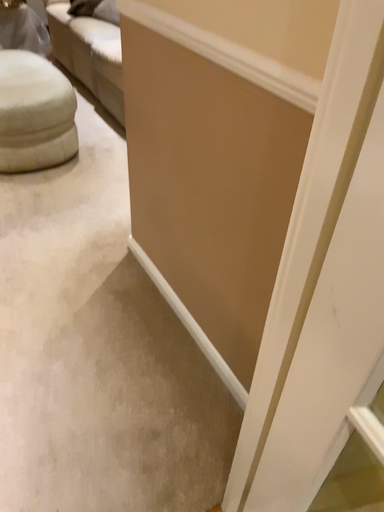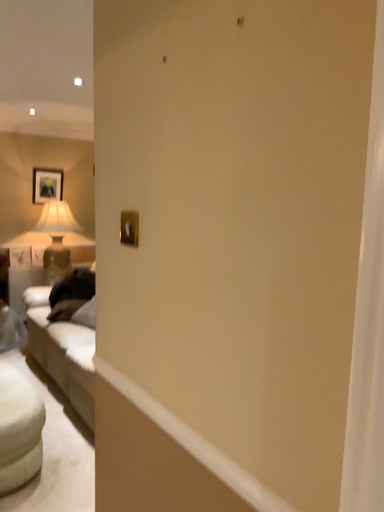
Question: Which way did the camera rotate in the video?

Choices:
 (A) rotated upward
 (B) rotated downward

Answer: (A)